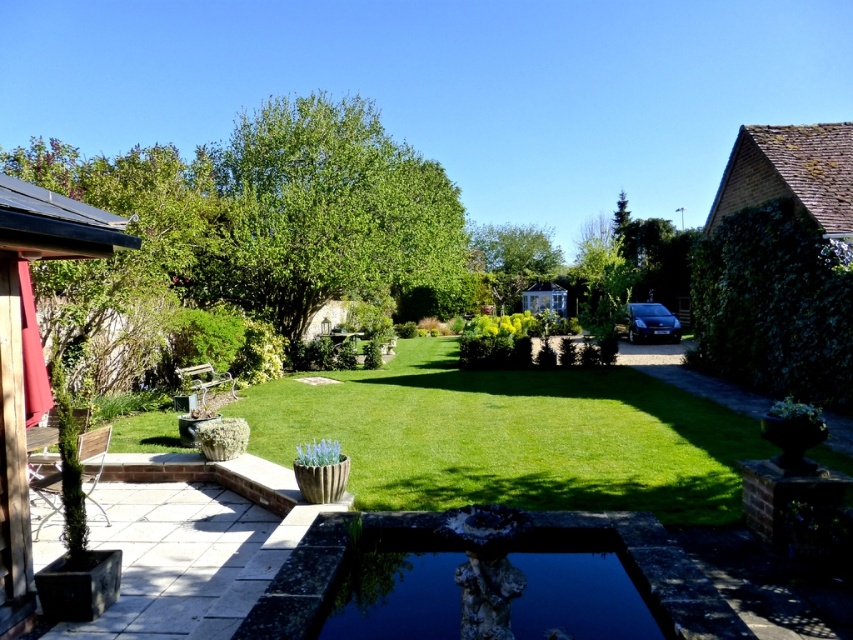
Does dark stone water at center have a greater height compared to smooth wooden terrace at left?

No, dark stone water at center is not taller than smooth wooden terrace at left.

Which is above, dark stone water at center or smooth wooden terrace at left?

smooth wooden terrace at left is higher up.

This screenshot has height=640, width=853. Identify the location of dark stone water at center. (576, 589).